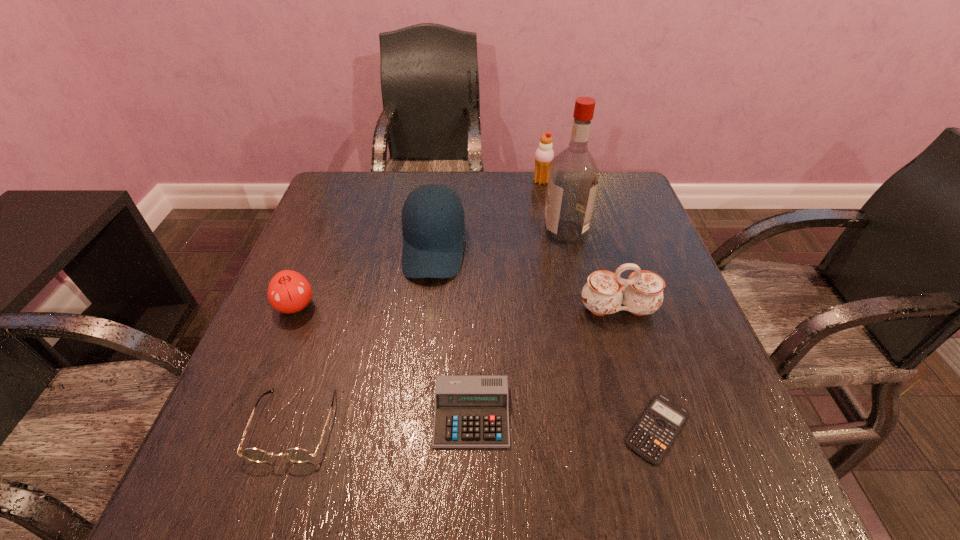
At what (x,y) coordinates should I click in order to perform the action: click on vacant area that lies between the spectacles and the second shortest object. Please return your answer as a coordinate pair (x, y). The image size is (960, 540). Looking at the image, I should click on [x=383, y=420].

Find the location of a particular element. The width and height of the screenshot is (960, 540). empty space that is in between the shorter calculator and the apple is located at coordinates (476, 367).

In order to click on unoccupied area between the tallest object and the seventh tallest object in this screenshot , I will do `click(518, 323)`.

The image size is (960, 540). Identify the location of empty space between the third shortest object and the farthest object. (418, 303).

Locate an element on the screen. vacant point located between the chinaware and the left calculator is located at coordinates (544, 362).

I want to click on free spot between the third shortest object and the apple, so click(x=295, y=365).

Identify which object is located as the seventh nearest to the liquor. Please provide its 2D coordinates. Your answer should be formatted as a tuple, i.e. [(x, y)], where the tuple contains the x and y coordinates of a point satisfying the conditions above.

[(298, 455)]

The image size is (960, 540). I want to click on object that stands as the closest to the taller calculator, so click(298, 455).

Find the location of `blank area in the image that satisfies the following two spatial constraints: 1. at the front with a straw on the icecream; 2. on the front-facing side of the baseball cap`. blank area in the image that satisfies the following two spatial constraints: 1. at the front with a straw on the icecream; 2. on the front-facing side of the baseball cap is located at coordinates (554, 248).

The image size is (960, 540). I want to click on blank space that satisfies the following two spatial constraints: 1. on the front-facing side of the liquor; 2. on the front-facing side of the baseball cap, so click(x=568, y=248).